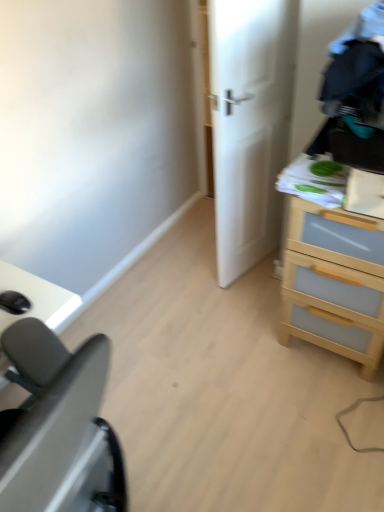
Find the location of a particular element. vacant space underneath white matte door at center (from a real-world perspective) is located at coordinates (259, 265).